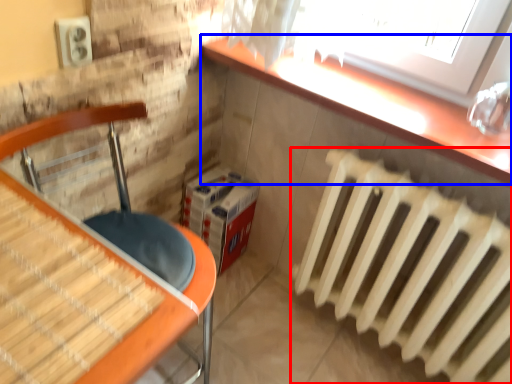
Question: Which object appears closest to the camera in this image, radiator (highlighted by a red box) or counter top (highlighted by a blue box)?

Choices:
 (A) radiator
 (B) counter top

Answer: (A)